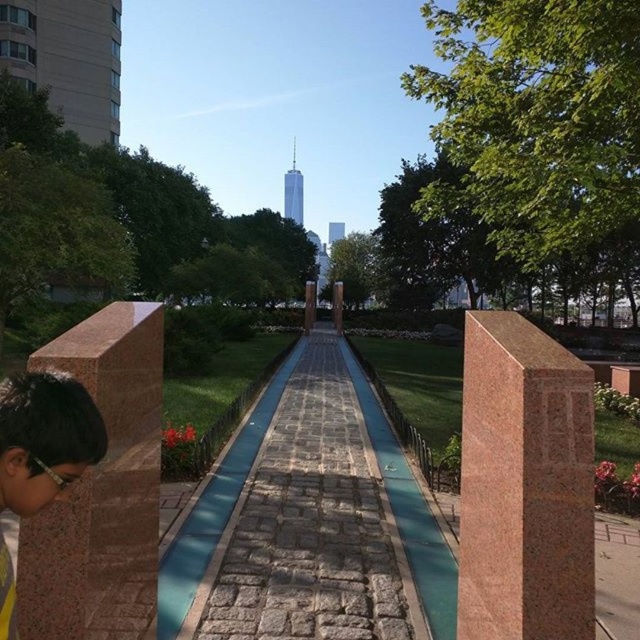
Which is in front, point (321, 400) or point (8, 499)?

Positioned in front is point (8, 499).

I want to click on stone paved walkway at center, so click(310, 522).